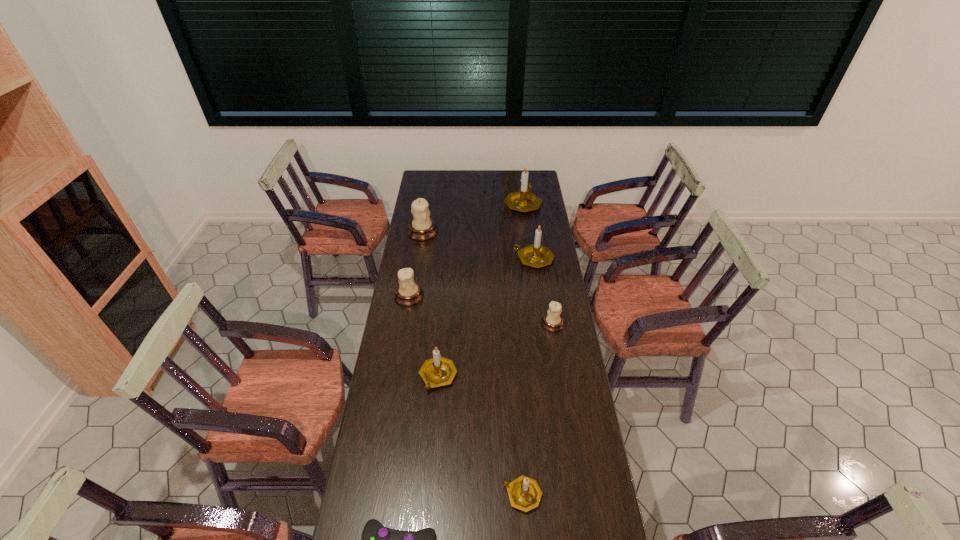
Where is `the rightmost white candle holder`? The image size is (960, 540). the rightmost white candle holder is located at coordinates (552, 321).

Where is `the third nearest candle holder`? This screenshot has height=540, width=960. the third nearest candle holder is located at coordinates (552, 321).

This screenshot has height=540, width=960. Identify the location of the smallest gold candle holder. (524, 493).

The image size is (960, 540). In order to click on the nearest gold candle holder in this screenshot , I will do `click(524, 493)`.

Where is `vacant space situated on the front of the biggest gold candle holder`? vacant space situated on the front of the biggest gold candle holder is located at coordinates (527, 241).

This screenshot has width=960, height=540. Identify the location of vacant space positioned 0.060m on the front of the second farthest object. (420, 249).

Image resolution: width=960 pixels, height=540 pixels. What are the coordinates of `free spot located on the left of the third farthest object` in the screenshot? It's located at (434, 259).

Identify the location of free space located 0.380m on the front of the second farthest white candle holder. (396, 381).

This screenshot has width=960, height=540. Find the location of `free space located on the right of the sixth farthest object`. free space located on the right of the sixth farthest object is located at coordinates (557, 376).

You are a GUI agent. You are given a task and a screenshot of the screen. Output one action in this format:
    pyautogui.click(x=<x>, y=<y>)
    Task: Click on the free location located on the left of the smallest white candle holder
    The image size is (960, 540).
    Given the screenshot: What is the action you would take?
    pyautogui.click(x=524, y=324)